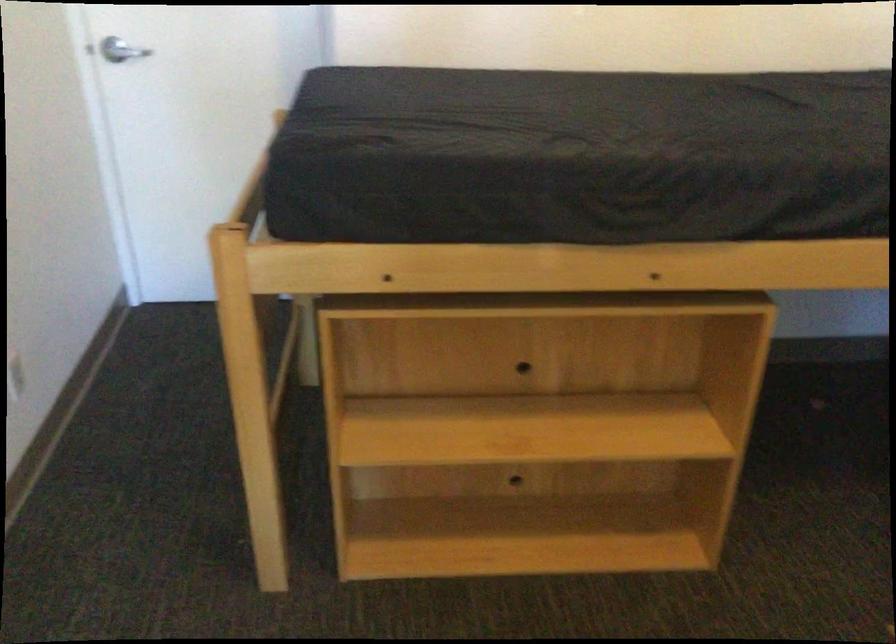
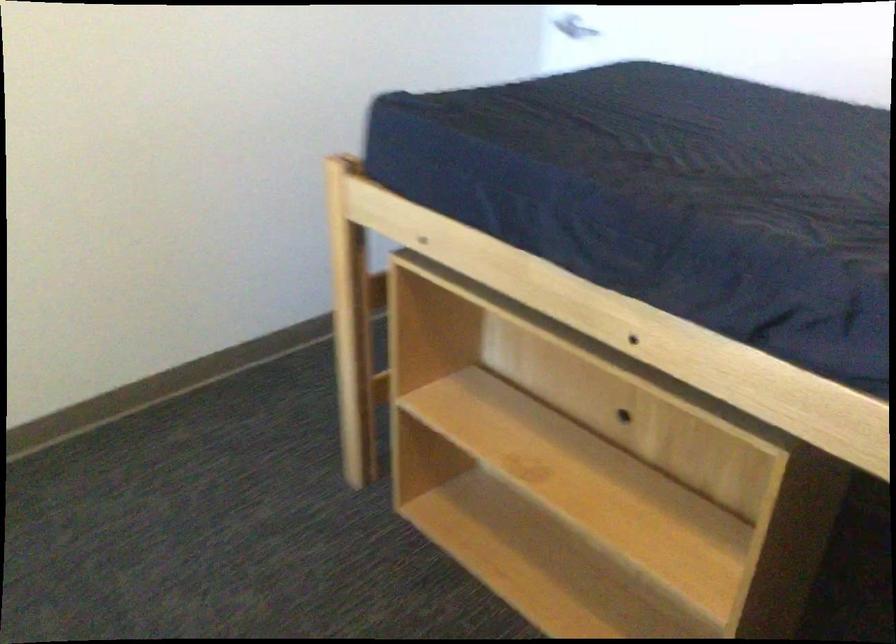
The point at (633,154) is marked in the first image. Where is the corresponding point in the second image?

(651, 193)